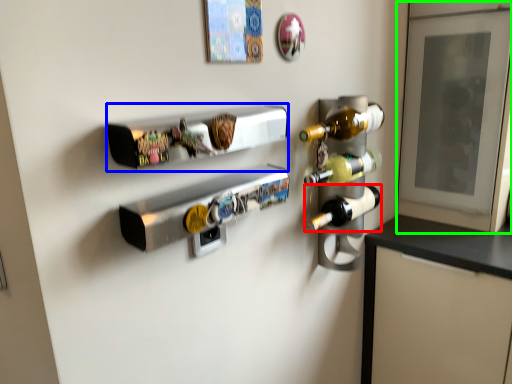
Question: Considering the real-world distances, which object is closest to bottle (highlighted by a red box)? shelf (highlighted by a blue box) or glass door (highlighted by a green box).

Choices:
 (A) shelf
 (B) glass door

Answer: (A)